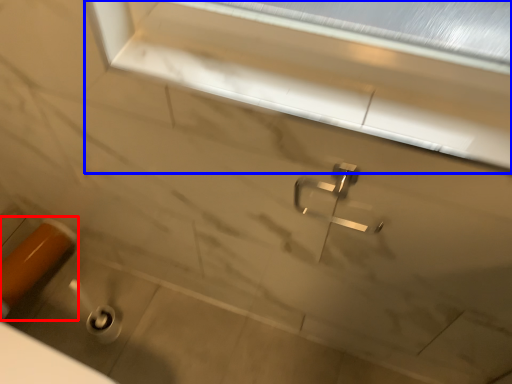
Question: Which object is closer to the camera taking this photo, door handle (highlighted by a red box) or window frame (highlighted by a blue box)?

Choices:
 (A) door handle
 (B) window frame

Answer: (B)